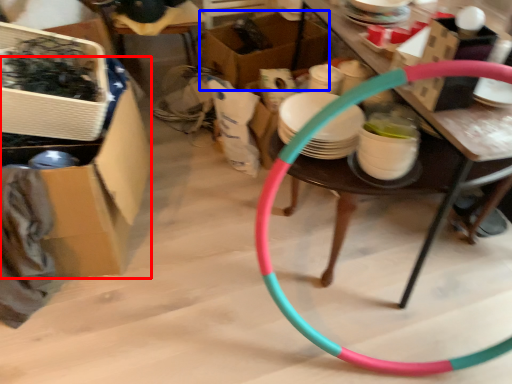
Question: Which point is closer to the camera, box (highlighted by a red box) or box (highlighted by a blue box)?

Choices:
 (A) box
 (B) box

Answer: (A)